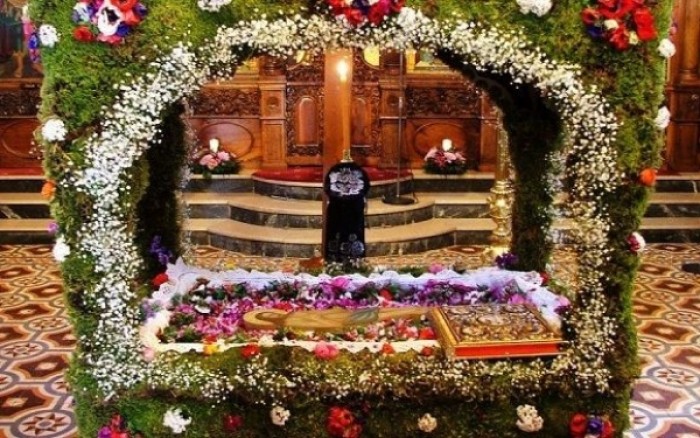
This screenshot has width=700, height=438. In order to click on floor in this screenshot , I will do `click(22, 314)`, `click(652, 309)`.